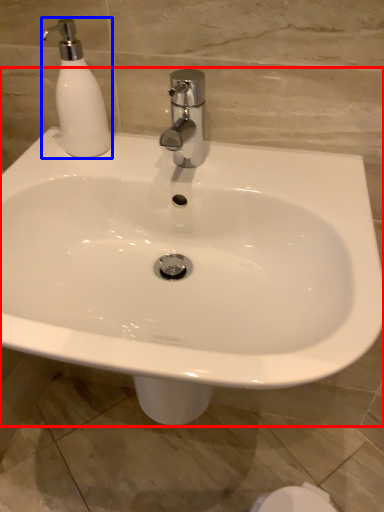
Question: Which of the following is the farthest to the observer, sink (highlighted by a red box) or soap dispenser (highlighted by a blue box)?

Choices:
 (A) sink
 (B) soap dispenser

Answer: (B)